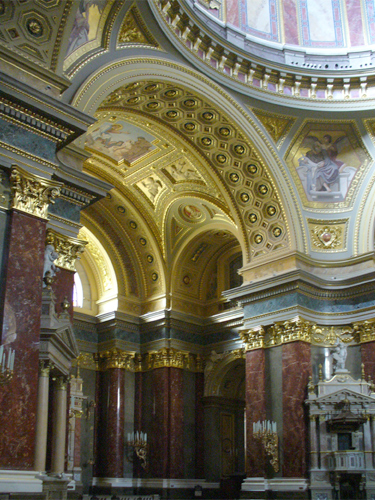
I want to click on gold base on candalabras, so click(x=141, y=453), click(x=270, y=443).